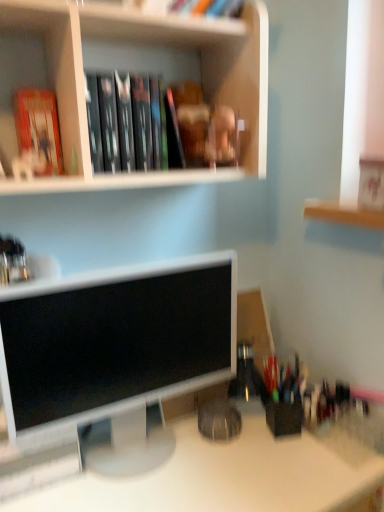
Question: From the image's perspective, would you say white matte bookshelf at upper center is shown under hardcover books at upper center?

Choices:
 (A) no
 (B) yes

Answer: (A)

Question: From the image's perspective, is white matte bookshelf at upper center above hardcover books at upper center?

Choices:
 (A) yes
 (B) no

Answer: (A)

Question: Does white matte bookshelf at upper center have a greater width compared to hardcover books at upper center?

Choices:
 (A) yes
 (B) no

Answer: (A)

Question: Are white matte bookshelf at upper center and hardcover books at upper center making contact?

Choices:
 (A) no
 (B) yes

Answer: (A)

Question: Could hardcover books at upper center be considered to be inside white matte bookshelf at upper center?

Choices:
 (A) no
 (B) yes

Answer: (B)

Question: Is white matte bookshelf at upper center in front of hardcover books at upper center?

Choices:
 (A) yes
 (B) no

Answer: (A)

Question: Is hardcover book at upper left bigger than white glossy desk at center?

Choices:
 (A) no
 (B) yes

Answer: (A)

Question: From a real-world perspective, is hardcover book at upper left physically below white glossy desk at center?

Choices:
 (A) yes
 (B) no

Answer: (B)

Question: From a real-world perspective, is hardcover book at upper left on top of white glossy desk at center?

Choices:
 (A) no
 (B) yes

Answer: (B)

Question: Is hardcover book at upper left next to white glossy desk at center and touching it?

Choices:
 (A) no
 (B) yes

Answer: (A)

Question: Is hardcover book at upper left positioned with its back to white glossy desk at center?

Choices:
 (A) yes
 (B) no

Answer: (B)

Question: Is hardcover book at upper left positioned in front of white glossy desk at center?

Choices:
 (A) no
 (B) yes

Answer: (A)

Question: From a real-world perspective, is hardcover books at upper center over matte white monitor at center?

Choices:
 (A) no
 (B) yes

Answer: (B)